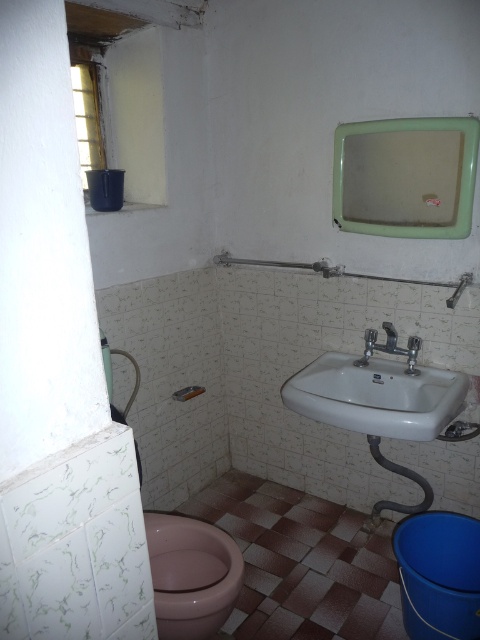
Does green plastic mirror at upper center have a lesser height compared to white glossy sink at lower right?

No.

Is point (444, 224) positioned behind point (391, 372)?

No, it is not.

Where is `green plastic mirror at upper center`? The height and width of the screenshot is (640, 480). green plastic mirror at upper center is located at coordinates (406, 177).

Where is `green plastic mirror at upper center`? green plastic mirror at upper center is located at coordinates (406, 177).

Can you confirm if white glossy sink at lower right is thinner than silver metallic faucet at sink right?

Incorrect, white glossy sink at lower right's width is not less than silver metallic faucet at sink right's.

Can you confirm if white glossy sink at lower right is positioned above silver metallic faucet at sink right?

No.

Who is more forward, (381, 368) or (386, 328)?

Point (386, 328) is more forward.

Find the location of `white glossy sink at lower right`. white glossy sink at lower right is located at coordinates (376, 396).

Is green plastic mirror at upper center thinner than pink glossy toilet bowl at lower left?

No, green plastic mirror at upper center is not thinner than pink glossy toilet bowl at lower left.

Looking at this image, can you confirm if green plastic mirror at upper center is bigger than pink glossy toilet bowl at lower left?

Yes.

What are the coordinates of `green plastic mirror at upper center` in the screenshot? It's located at (406, 177).

This screenshot has width=480, height=640. I want to click on green plastic mirror at upper center, so click(406, 177).